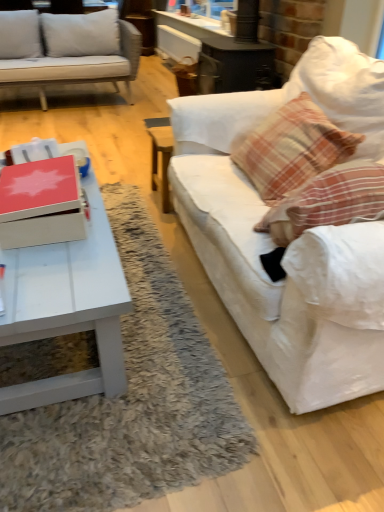
Question: Is plaid fabric pillow at right further to the viewer compared to white fabric couch at right?

Choices:
 (A) no
 (B) yes

Answer: (B)

Question: Is plaid fabric pillow at right bigger than white fabric couch at right?

Choices:
 (A) yes
 (B) no

Answer: (B)

Question: Does plaid fabric pillow at right have a lesser width compared to white fabric couch at right?

Choices:
 (A) yes
 (B) no

Answer: (A)

Question: From a real-world perspective, is plaid fabric pillow at right located higher than white fabric couch at right?

Choices:
 (A) yes
 (B) no

Answer: (A)

Question: From the image's perspective, would you say plaid fabric pillow at right is shown under white fabric couch at right?

Choices:
 (A) no
 (B) yes

Answer: (A)

Question: In the image, is white matte coffee table at lower left on the left side or the right side of white fabric couch at right?

Choices:
 (A) right
 (B) left

Answer: (B)

Question: In the image, is white matte coffee table at lower left positioned in front of or behind white fabric couch at right?

Choices:
 (A) behind
 (B) front

Answer: (A)

Question: Is white matte coffee table at lower left bigger or smaller than white fabric couch at right?

Choices:
 (A) big
 (B) small

Answer: (B)

Question: From the image's perspective, relative to white fabric couch at right, is white matte coffee table at lower left above or below?

Choices:
 (A) above
 (B) below

Answer: (B)

Question: From the image's perspective, is white fabric couch at right positioned above or below white matte coffee table at lower left?

Choices:
 (A) above
 (B) below

Answer: (A)

Question: Which is correct: white fabric couch at right is inside white matte coffee table at lower left, or outside of it?

Choices:
 (A) outside
 (B) inside

Answer: (A)

Question: Is white fabric couch at right in front of or behind white matte coffee table at lower left in the image?

Choices:
 (A) front
 (B) behind

Answer: (A)

Question: In terms of width, does white fabric couch at right look wider or thinner when compared to white matte coffee table at lower left?

Choices:
 (A) thin
 (B) wide

Answer: (A)

Question: From the image's perspective, is plaid fabric pillow at right above or below matte red box at center?

Choices:
 (A) above
 (B) below

Answer: (A)

Question: Relative to matte red box at center, is plaid fabric pillow at right in front or behind?

Choices:
 (A) behind
 (B) front

Answer: (A)